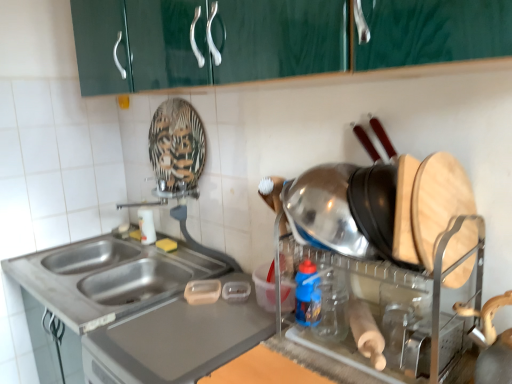
Locate an element on the screen. This screenshot has width=512, height=384. free point in front of blue plastic bottle at center, the first bottle positioned from the front is located at coordinates point(318,354).